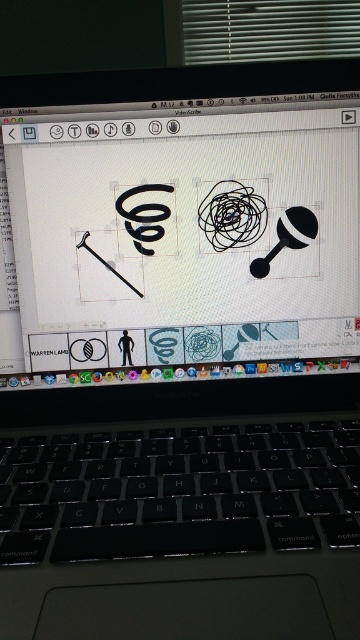
Question: Is black matte drawing at center further to camera compared to black matte keyboard at lower center?

Choices:
 (A) no
 (B) yes

Answer: (B)

Question: Is black matte drawing at center smaller than black matte keyboard at lower center?

Choices:
 (A) yes
 (B) no

Answer: (A)

Question: Which object is farther from the camera taking this photo?

Choices:
 (A) black matte drawing at center
 (B) black matte keyboard at lower center

Answer: (A)

Question: Which point appears farthest from the camera in this image?

Choices:
 (A) (239, 536)
 (B) (281, 161)

Answer: (B)

Question: Does black matte drawing at center come behind black matte keyboard at lower center?

Choices:
 (A) yes
 (B) no

Answer: (A)